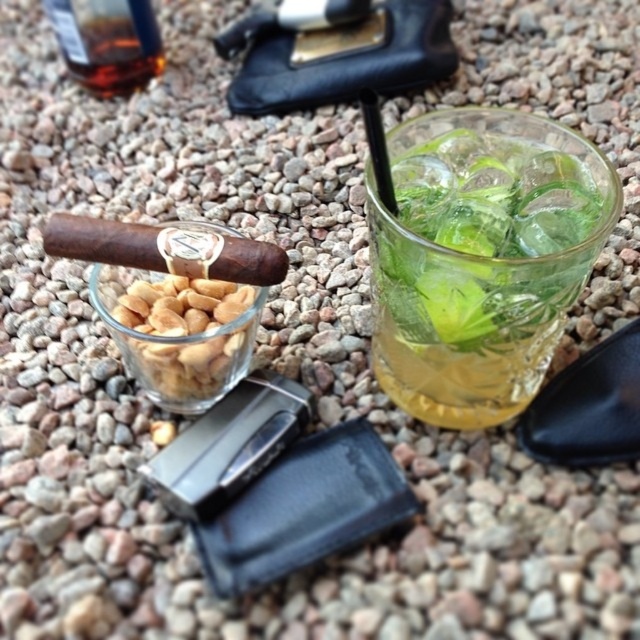
Image resolution: width=640 pixels, height=640 pixels. What do you see at coordinates (481, 257) in the screenshot? I see `clear glass ice at upper right` at bounding box center [481, 257].

Is point (499, 188) farther from viewer compared to point (124, 60)?

No, it is not.

Identify the location of clear glass ice at upper right. (481, 257).

Consider the image. Which is above, clear glass ice at upper right or translucent glass peanuts at center?

clear glass ice at upper right

Is clear glass ice at upper right below translucent glass peanuts at center?

Incorrect, clear glass ice at upper right is not positioned below translucent glass peanuts at center.

Who is more distant from viewer, [467,241] or [166,294]?

Positioned behind is point [166,294].

This screenshot has width=640, height=640. I want to click on clear glass ice at upper right, so click(x=481, y=257).

Is translucent glass peanuts at center behind translucent glass bottle at upper left?

No, it is not.

Measure the distance from translucent glass peanuts at center to translucent glass bottle at upper left.

23.01 inches

Which is behind, point (170, 301) or point (125, 88)?

Point (125, 88)

Find the location of a particular element. translucent glass peanuts at center is located at coordinates (179, 332).